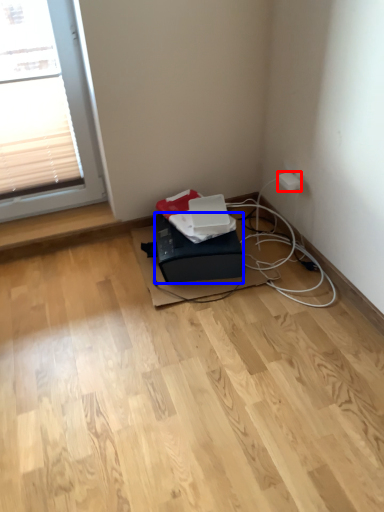
Question: Which object appears farthest to the camera in this image, electric outlet (highlighted by a red box) or box (highlighted by a blue box)?

Choices:
 (A) electric outlet
 (B) box

Answer: (A)